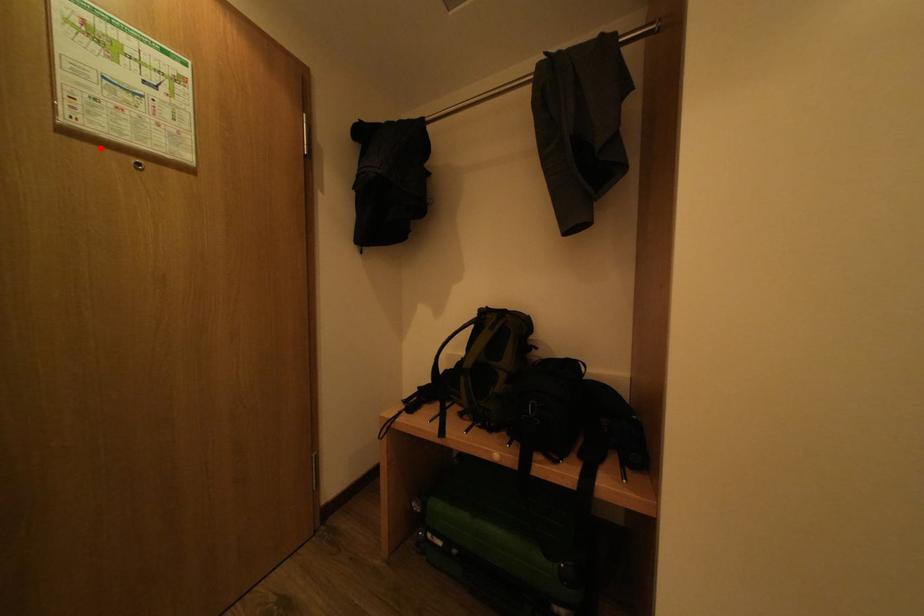
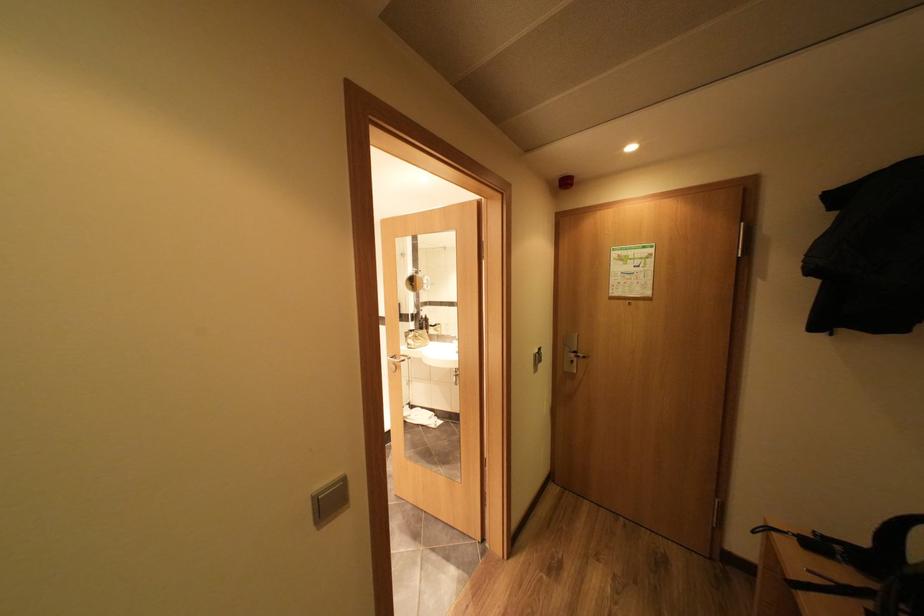
Find the pixel in the second image that matches the highlighted location in the first image.

(626, 302)